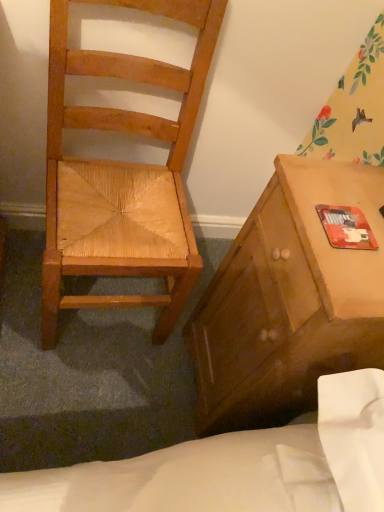
The height and width of the screenshot is (512, 384). I want to click on empty space that is ontop of matte wooden cabinet at right, so click(x=348, y=224).